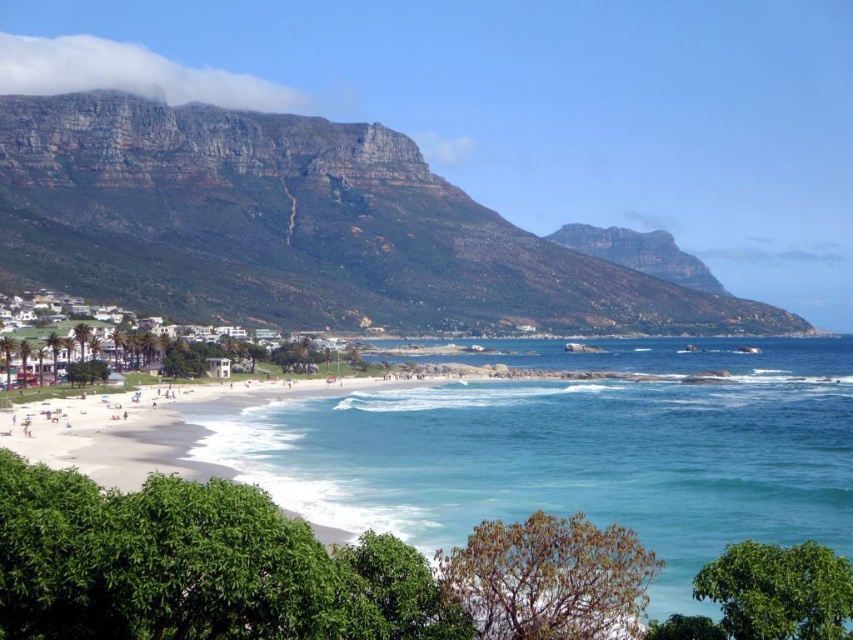
Question: Is rugged rock mountain at upper center to the right of clear blue water at center from the viewer's perspective?

Choices:
 (A) no
 (B) yes

Answer: (A)

Question: Is rugged rock mountain at upper center wider than clear blue water at center?

Choices:
 (A) yes
 (B) no

Answer: (A)

Question: Which point is closer to the camera?

Choices:
 (A) (292, 480)
 (B) (53, 104)

Answer: (A)

Question: Is rugged rock mountain at upper center smaller than clear blue water at center?

Choices:
 (A) no
 (B) yes

Answer: (A)